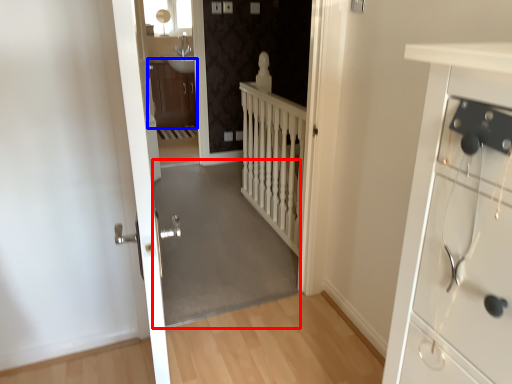
Question: Which point is closer to the camera, corridor (highlighted by a red box) or cabinetry (highlighted by a blue box)?

Choices:
 (A) corridor
 (B) cabinetry

Answer: (A)